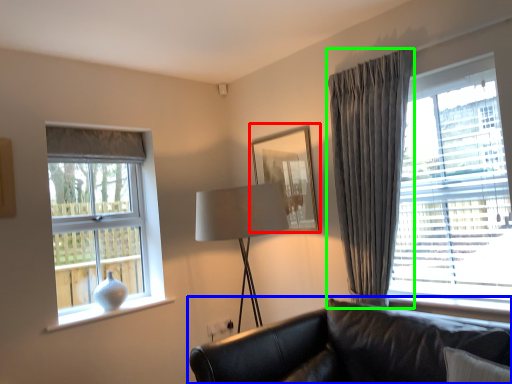
Question: Based on their relative distances, which object is farther from picture frame (highlighted by a red box)? Choose from studio couch (highlighted by a blue box) and curtain (highlighted by a green box).

Choices:
 (A) studio couch
 (B) curtain

Answer: (A)